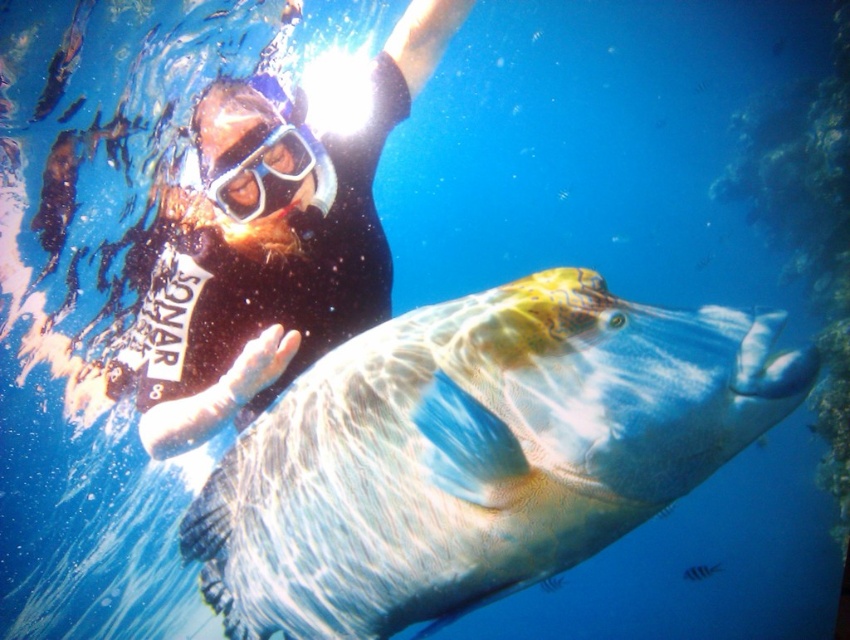
You are a marine biologist observing an underwater scene. You notice the matte black snorkel gear at upper center and the transparent plastic goggles at center. Which object is closer to you, the observer?

The matte black snorkel gear at upper center is closer to you because it is in front of the transparent plastic goggles at center.

You are a marine biologist observing the underwater scene. You notice the matte black snorkel gear at upper center and the transparent plastic goggles at center. Which object is positioned higher in the image?

The matte black snorkel gear at upper center is positioned higher than the transparent plastic goggles at center because it is taller than the goggles.